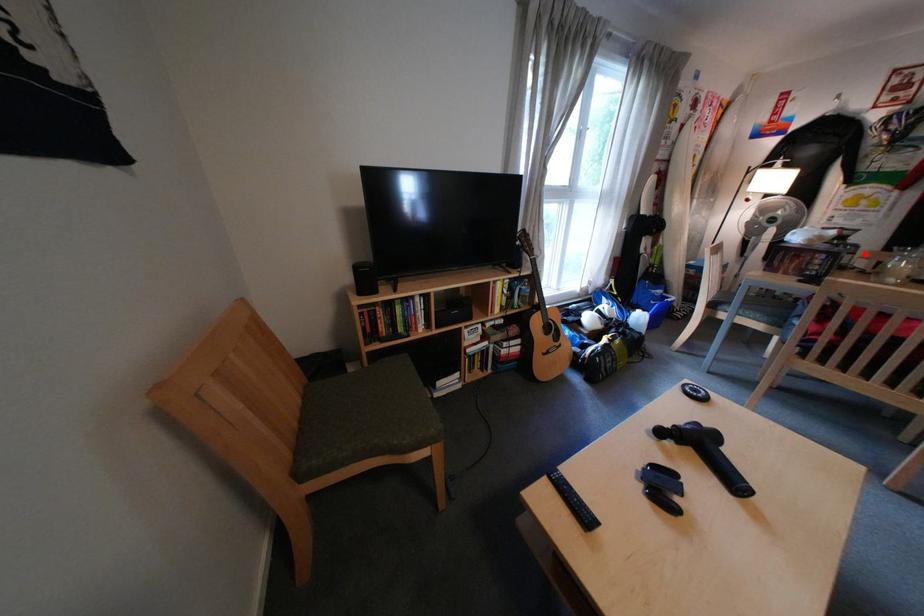
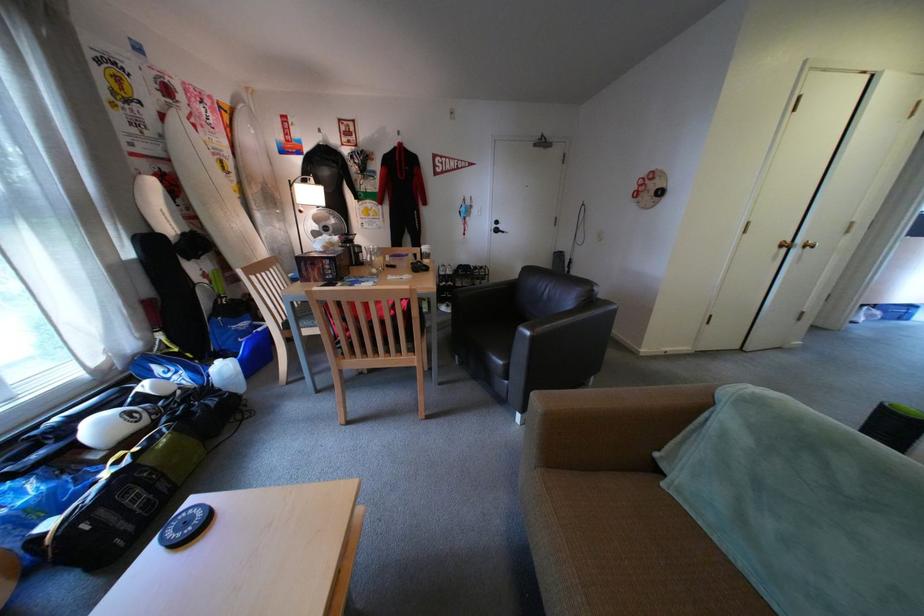
Question: I am providing you with two images of the same scene from different viewpoints. In image1, a red point is highlighted. Considering the same 3D point in image2, which of the following is correct?

Choices:
 (A) It is closer
 (B) It is farther

Answer: (A)